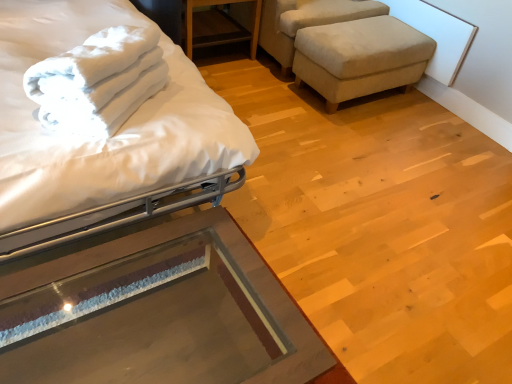
Question: Is beige fabric stool at right thinner than white soft towel at upper left?

Choices:
 (A) no
 (B) yes

Answer: (A)

Question: Can you confirm if beige fabric stool at right is smaller than white soft towel at upper left?

Choices:
 (A) yes
 (B) no

Answer: (B)

Question: Can you confirm if beige fabric stool at right is positioned to the right of white soft towel at upper left?

Choices:
 (A) no
 (B) yes

Answer: (B)

Question: Is beige fabric stool at right not near white soft towel at upper left?

Choices:
 (A) no
 (B) yes

Answer: (B)

Question: Can we say beige fabric stool at right lies outside white soft towel at upper left?

Choices:
 (A) yes
 (B) no

Answer: (A)

Question: In terms of size, does wooden table at upper center, acting as the second table starting from the bottom, appear bigger or smaller than white soft towel at upper left?

Choices:
 (A) small
 (B) big

Answer: (B)

Question: From a real-world perspective, relative to white soft towel at upper left, is wooden table at upper center, acting as the second table starting from the bottom, vertically above or below?

Choices:
 (A) above
 (B) below

Answer: (B)

Question: Considering the positions of wooden table at upper center, which is counted as the second table, starting from the front, and white soft towel at upper left in the image, is wooden table at upper center, which is counted as the second table, starting from the front, wider or thinner than white soft towel at upper left?

Choices:
 (A) wide
 (B) thin

Answer: (A)

Question: Considering the positions of point (187, 16) and point (36, 77), is point (187, 16) closer or farther from the camera than point (36, 77)?

Choices:
 (A) farther
 (B) closer

Answer: (A)

Question: Is point (59, 59) positioned closer to the camera than point (67, 165)?

Choices:
 (A) closer
 (B) farther

Answer: (B)

Question: In terms of width, does white soft towel at upper left look wider or thinner when compared to white matte bed at left?

Choices:
 (A) thin
 (B) wide

Answer: (A)

Question: Is white soft towel at upper left bigger or smaller than white matte bed at left?

Choices:
 (A) big
 (B) small

Answer: (B)

Question: Is white soft towel at upper left in front of or behind white matte bed at left in the image?

Choices:
 (A) behind
 (B) front

Answer: (A)

Question: Considering the positions of point (272, 31) and point (99, 382), is point (272, 31) closer or farther from the camera than point (99, 382)?

Choices:
 (A) farther
 (B) closer

Answer: (A)

Question: Relative to transparent glass table at lower left, placed as the 2th table when sorted from top to bottom, is beige fabric swivel chair at upper right in front or behind?

Choices:
 (A) behind
 (B) front

Answer: (A)